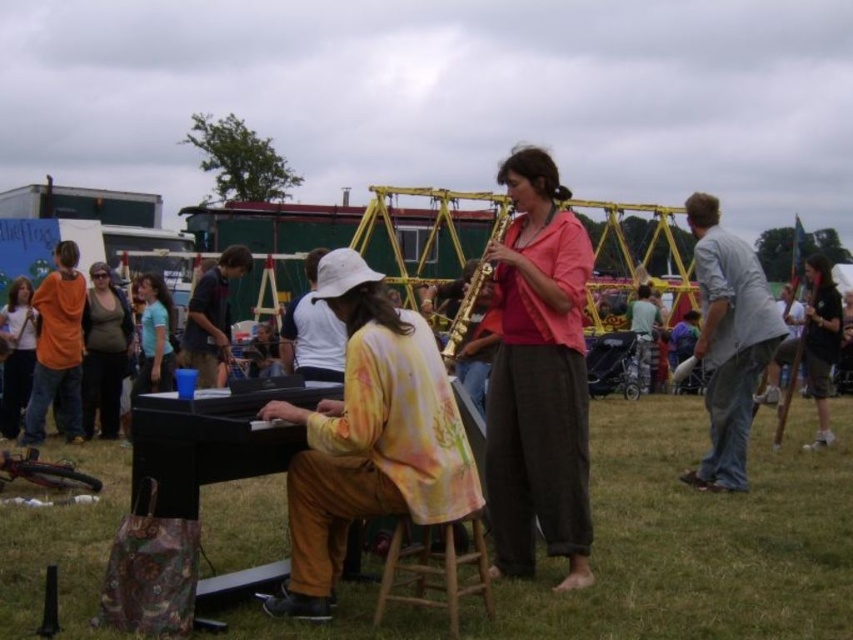
Can you confirm if black polished piano at center is thinner than dark blue shirt at center?

Yes.

Does point (283, 460) come closer to viewer compared to point (216, 301)?

Yes, it is in front of point (216, 301).

Between point (256, 452) and point (190, 333), which one is positioned in front?

Point (256, 452)

Where is `black polished piano at center`? The image size is (853, 640). black polished piano at center is located at coordinates (207, 444).

Which is in front, point (526, 490) or point (728, 333)?

Point (526, 490)

Which is in front, point (538, 488) or point (741, 262)?

Point (538, 488)

I want to click on pink fabric shirt at center, so click(x=538, y=378).

Is floral silk shirt at center thinner than matte black shirt at center?

Yes, floral silk shirt at center is thinner than matte black shirt at center.

Which is behind, point (378, 484) or point (117, 301)?

The point (117, 301) is behind.

Is point (436, 410) farther from camera compared to point (112, 314)?

No.

This screenshot has height=640, width=853. In order to click on floral silk shirt at center in this screenshot , I will do `click(370, 436)`.